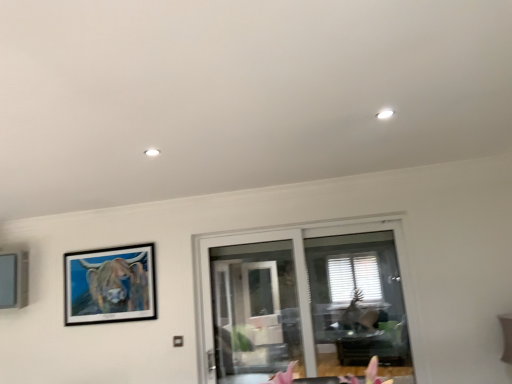
Question: Is wooden-framed painting at upper left, marked as the 1th picture frame in a right-to-left arrangement, in front of or behind transparent glass door at center in the image?

Choices:
 (A) behind
 (B) front

Answer: (A)

Question: Considering the positions of wooden-framed painting at upper left, marked as the 1th picture frame in a right-to-left arrangement, and transparent glass door at center in the image, is wooden-framed painting at upper left, marked as the 1th picture frame in a right-to-left arrangement, bigger or smaller than transparent glass door at center?

Choices:
 (A) big
 (B) small

Answer: (B)

Question: Estimate the real-world distances between objects in this image. Which object is closer to the matte gray picture frame at left, which is the first picture frame in left-to-right order?

Choices:
 (A) wooden-framed painting at upper left, marked as the 1th picture frame in a right-to-left arrangement
 (B) transparent glass door at center

Answer: (A)

Question: Which is nearer to the transparent glass door at center?

Choices:
 (A) matte gray picture frame at left, which is the first picture frame in left-to-right order
 (B) wooden-framed painting at upper left, which ranks as the 2th picture frame in left-to-right order

Answer: (B)